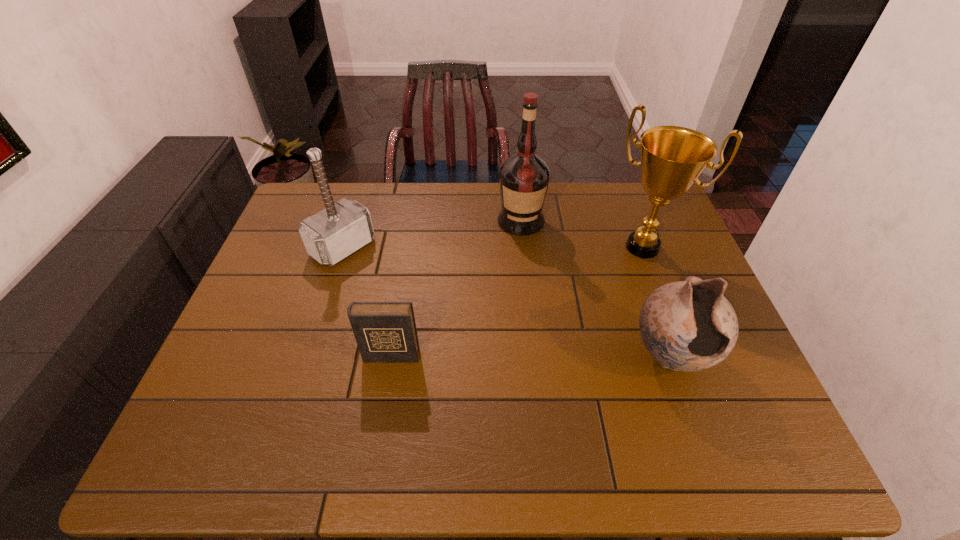
The width and height of the screenshot is (960, 540). I want to click on vacant space located on the front view with handles of the award, so click(595, 312).

Image resolution: width=960 pixels, height=540 pixels. I want to click on vacant space located 0.150m for striking with the head of the hammer, so click(395, 286).

At what (x,y) coordinates should I click in order to perform the action: click on free space located for striking with the head of the hammer. Please return your answer as a coordinate pair (x, y). Image resolution: width=960 pixels, height=540 pixels. Looking at the image, I should click on (440, 320).

Locate an element on the screen. vacant area located for striking with the head of the hammer is located at coordinates (390, 283).

Locate an element on the screen. The image size is (960, 540). free space located on the surface of the third object from left to right is located at coordinates (525, 291).

In order to click on free space located on the surface of the third object from left to right in this screenshot , I will do `click(526, 315)`.

Find the location of a particular element. vacant space located 0.110m on the surface of the third object from left to right is located at coordinates (523, 261).

The height and width of the screenshot is (540, 960). What are the coordinates of `object positioned at the far edge` in the screenshot? It's located at (524, 177).

You are a GUI agent. You are given a task and a screenshot of the screen. Output one action in this format:
    pyautogui.click(x=<x>, y=<y>)
    Task: Click on the object that is at the near edge
    
    Given the screenshot: What is the action you would take?
    pyautogui.click(x=689, y=325)

What are the coordinates of `object positioned at the left edge` in the screenshot? It's located at (332, 234).